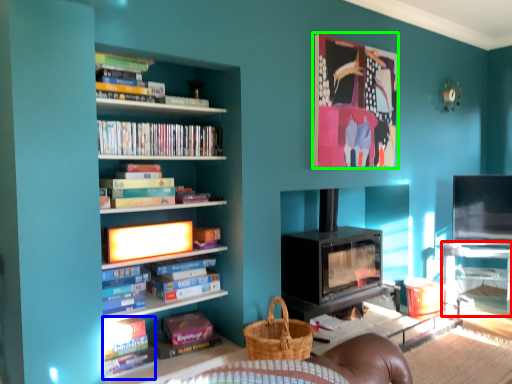
Question: Which object is the farthest from table (highlighted by a red box)? Choose among these: book (highlighted by a blue box) or picture frame (highlighted by a green box).

Choices:
 (A) book
 (B) picture frame

Answer: (A)